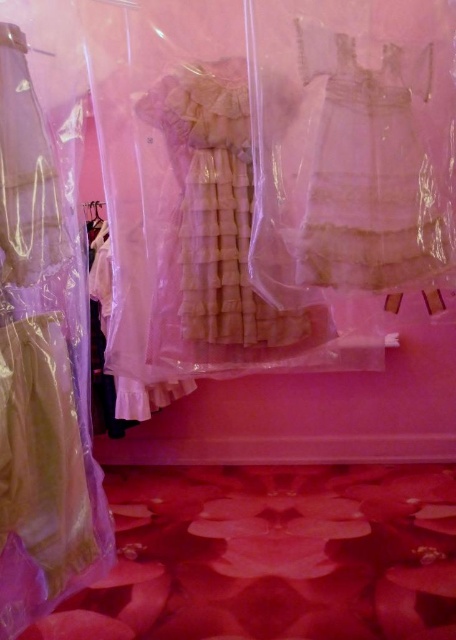
You are a fashion designer standing at the entrance of the boutique and want to locate the matte beige dress at center. According to the coordinates provided, where should you look in the display area?

The matte beige dress at center is located at the 2D coordinates point (41, 369) in the display area.

You are a customer in a boutique and see the matte beige dress at center and the white lace dress at center. Which dress is placed lower in the display?

The matte beige dress at center is positioned under the white lace dress at center, so it is placed lower in the display.